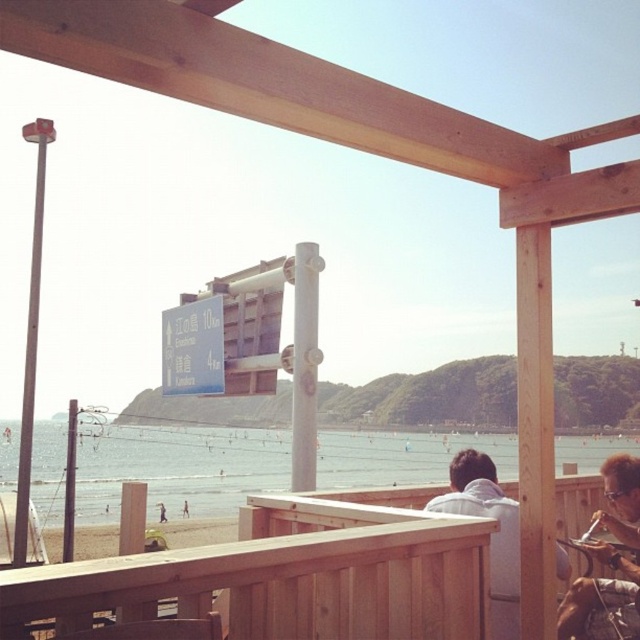
Is wooden bench at center bigger than white matte shirt at lower right?

Yes.

Image resolution: width=640 pixels, height=640 pixels. Find the location of `wooden bench at center`. wooden bench at center is located at coordinates (294, 572).

Does clear blue water at lower left appear on the right side of dark brown wooden bench at lower center?

Correct, you'll find clear blue water at lower left to the right of dark brown wooden bench at lower center.

Which is in front, point (436, 460) or point (161, 506)?

Positioned in front is point (161, 506).

This screenshot has width=640, height=640. In order to click on clear blue water at lower left in this screenshot , I will do `click(179, 468)`.

Can you confirm if matte brown hair at upper right is taller than white matte shirt at lower right?

Yes, matte brown hair at upper right is taller than white matte shirt at lower right.

Between matte brown hair at upper right and white matte shirt at lower right, which one is positioned higher?

Positioned higher is white matte shirt at lower right.

This screenshot has width=640, height=640. In order to click on matte brown hair at upper right in this screenshot , I will do `click(602, 600)`.